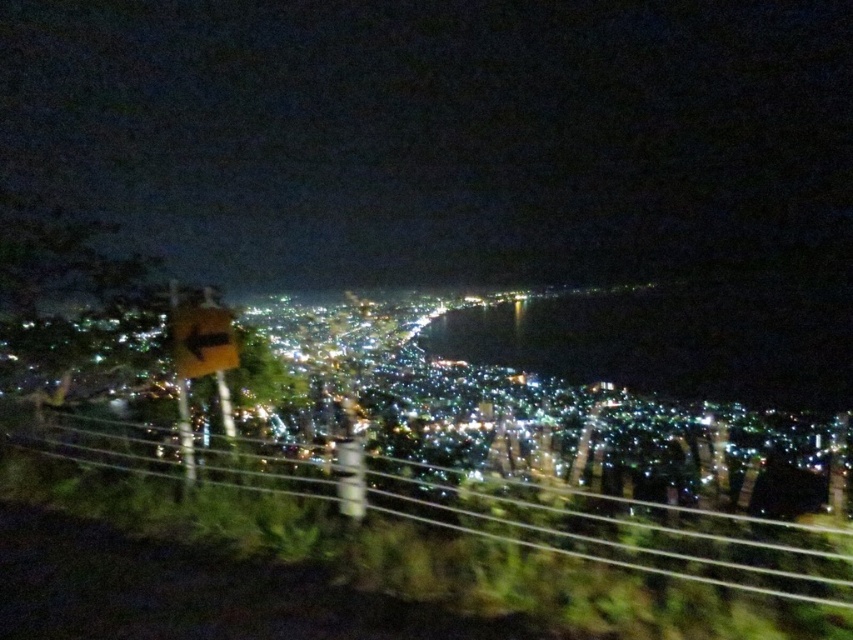
Question: Is metallic wire fence at lower center below yellow matte sign at lower left?

Choices:
 (A) yes
 (B) no

Answer: (A)

Question: Observing the image, what is the correct spatial positioning of metallic wire fence at lower center in reference to yellow matte sign at lower left?

Choices:
 (A) above
 (B) below

Answer: (B)

Question: Which object is closer to the camera taking this photo?

Choices:
 (A) yellow matte sign at lower left
 (B) metallic wire fence at lower center

Answer: (B)

Question: Which point is farther to the camera?

Choices:
 (A) (202, 356)
 (B) (724, 554)

Answer: (A)

Question: Is metallic wire fence at lower center to the left of yellow matte sign at lower left from the viewer's perspective?

Choices:
 (A) no
 (B) yes

Answer: (A)